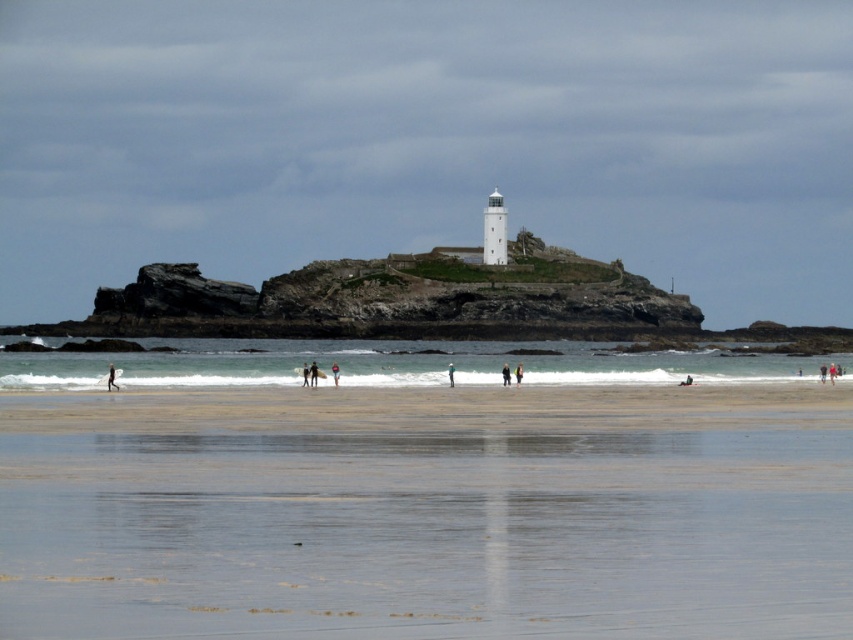
Is smooth sand at lower center positioned before light brown surfboard at center?

Yes, smooth sand at lower center is closer to the viewer.

Which is behind, point (515, 572) or point (514, 371)?

The point (514, 371) is more distant.

Is point (421, 449) less distant than point (520, 381)?

Yes, it is.

Find the location of a particular element. The width and height of the screenshot is (853, 640). smooth sand at lower center is located at coordinates (428, 513).

Is dark brown leather jacket at center shorter than red fabric person at center?

No, dark brown leather jacket at center is not shorter than red fabric person at center.

Is dark brown leather jacket at center to the right of red fabric person at center from the viewer's perspective?

In fact, dark brown leather jacket at center is to the left of red fabric person at center.

Where is `dark brown leather jacket at center`? This screenshot has width=853, height=640. dark brown leather jacket at center is located at coordinates (505, 374).

Is smooth sand at lower center bigger than dark brown leather jacket at center?

Indeed, smooth sand at lower center has a larger size compared to dark brown leather jacket at center.

Is smooth sand at lower center to the left of dark brown leather jacket at center from the viewer's perspective?

Yes, smooth sand at lower center is to the left of dark brown leather jacket at center.

Which is in front, point (756, 525) or point (505, 364)?

Positioned in front is point (756, 525).

Where is `smooth sand at lower center`? Image resolution: width=853 pixels, height=640 pixels. smooth sand at lower center is located at coordinates (428, 513).